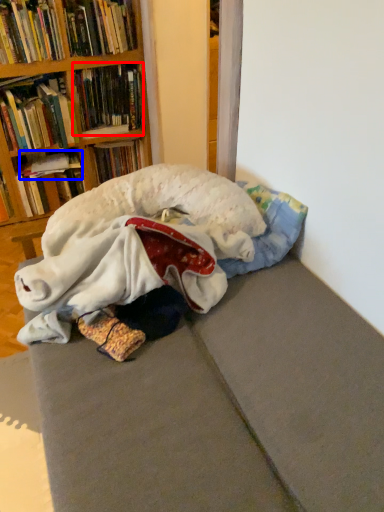
Question: Among these objects, which one is nearest to the camera, book (highlighted by a red box) or book (highlighted by a blue box)?

Choices:
 (A) book
 (B) book

Answer: (A)